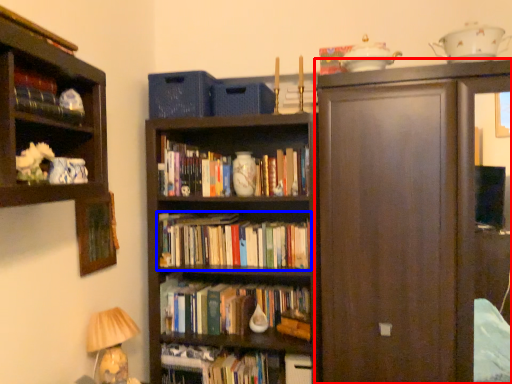
Question: Which object appears farthest to the camera in this image, cupboard (highlighted by a red box) or book (highlighted by a blue box)?

Choices:
 (A) cupboard
 (B) book

Answer: (B)